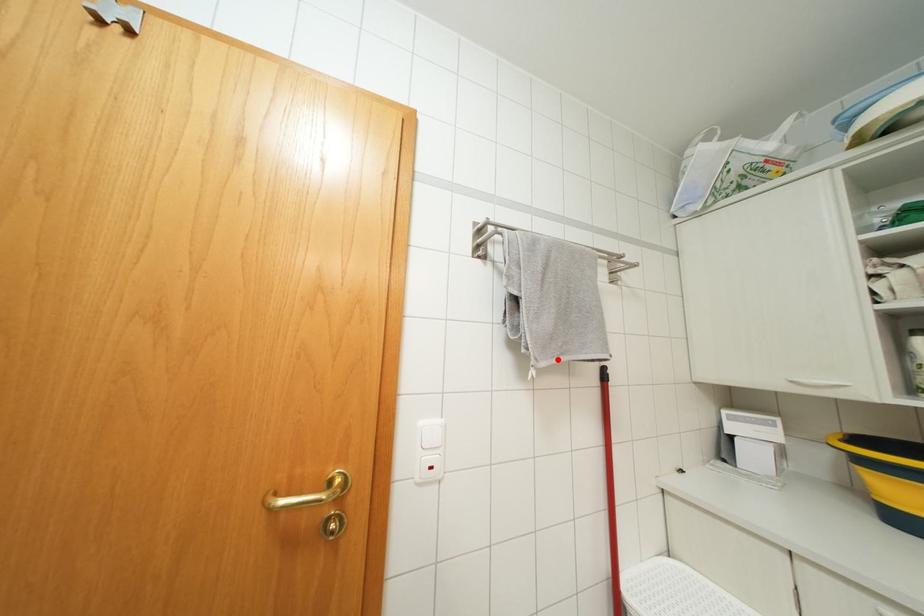
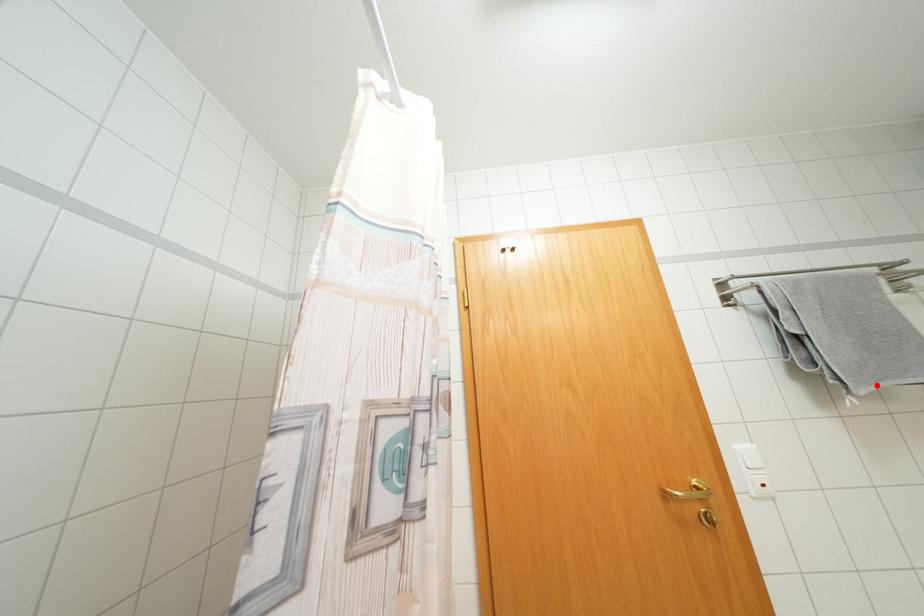
I am providing you with two images of the same scene from different viewpoints. A red point is marked on the first image and another point is marked on the second image. Are the points marked in image1 and image2 representing the same 3D position?

Yes